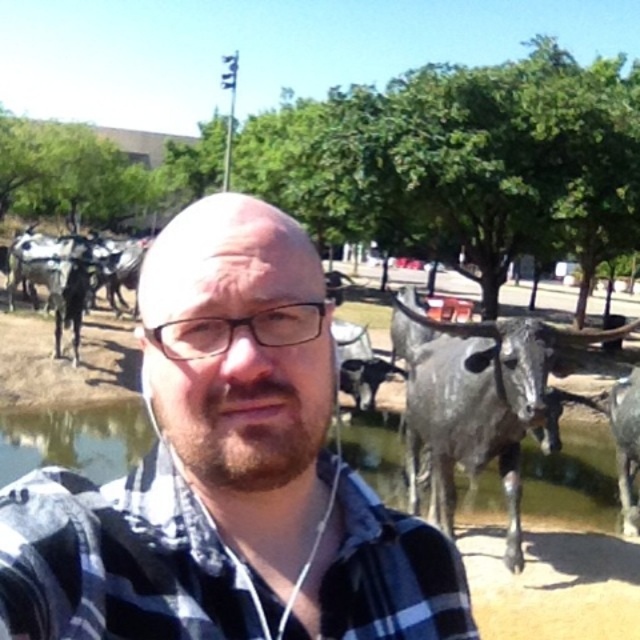
Based on the photo, you are a photographer aiming to capture the gray metallic bull at right in your shot while avoiding the clear water at center. Can you position yourself in a way that the bull is visible without the water obstructing the view?

The gray metallic bull at right is behind clear water at center, so positioning yourself behind the clear water at center would allow you to see the bull without the water blocking the view.

You are a photographer trying to capture the blue plaid shirt at center and the gray metallic bull at right in the same frame. Based on their positions, can you tell which object is closer to the camera?

The blue plaid shirt at center is above the gray metallic bull at right, so the bull is closer to the camera than the shirt.